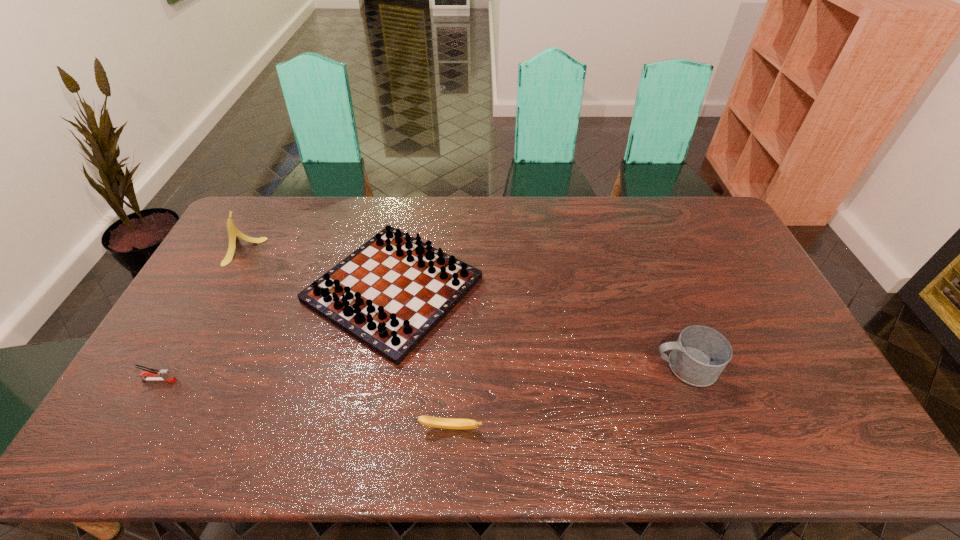
You are a GUI agent. You are given a task and a screenshot of the screen. Output one action in this format:
    pyautogui.click(x=<x>, y=<y>)
    Task: Click on the vacant position located on the side of the mug with the handle
    
    Given the screenshot: What is the action you would take?
    pyautogui.click(x=517, y=367)

At what (x,y) coordinates should I click in order to perform the action: click on vacant space situated 0.230m on the side of the mug with the handle. Please return your answer as a coordinate pair (x, y). This screenshot has width=960, height=540. Looking at the image, I should click on (x=568, y=367).

Identify the location of vacant space located on the handle side of the stapler. (253, 380).

Find the location of a particular element. Image resolution: width=960 pixels, height=540 pixels. banana that is at the far edge is located at coordinates (233, 233).

You are a GUI agent. You are given a task and a screenshot of the screen. Output one action in this format:
    pyautogui.click(x=<x>, y=<y>)
    Task: Click on the chessboard that is at the far edge
    
    Given the screenshot: What is the action you would take?
    pyautogui.click(x=389, y=294)

Identify the location of object present at the near edge. (445, 423).

At what (x,y) coordinates should I click in order to perform the action: click on banana at the left edge. Please return your answer as a coordinate pair (x, y). The width and height of the screenshot is (960, 540). Looking at the image, I should click on (233, 233).

The width and height of the screenshot is (960, 540). I want to click on stapler positioned at the left edge, so click(150, 374).

At what (x,y) coordinates should I click in order to perform the action: click on object located in the far left corner section of the desktop. Please return your answer as a coordinate pair (x, y). This screenshot has height=540, width=960. Looking at the image, I should click on (233, 233).

You are a GUI agent. You are given a task and a screenshot of the screen. Output one action in this format:
    pyautogui.click(x=<x>, y=<y>)
    Task: Click on the vacant region at the far edge
    
    Given the screenshot: What is the action you would take?
    pyautogui.click(x=372, y=212)